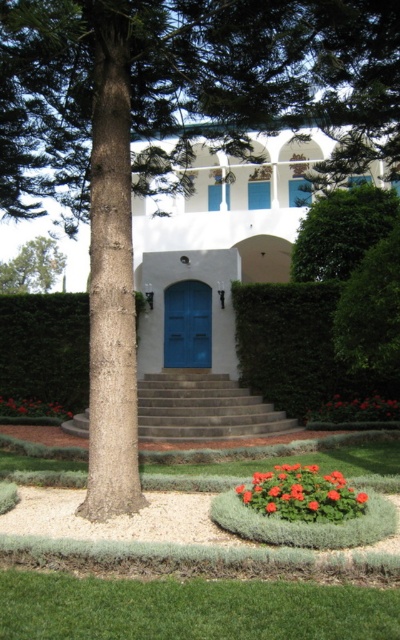
The image size is (400, 640). In order to click on green leafy hedge at center in this screenshot , I will do `click(299, 348)`.

Is green leafy hedge at center to the left of orange matte flower at center from the viewer's perspective?

Incorrect, green leafy hedge at center is not on the left side of orange matte flower at center.

Locate an element on the screen. The width and height of the screenshot is (400, 640). green leafy hedge at center is located at coordinates (299, 348).

Which is above, smooth concrete stairs at center or bright orange flowers at lower center?

Positioned higher is bright orange flowers at lower center.

Which of these two, smooth concrete stairs at center or bright orange flowers at lower center, stands shorter?

bright orange flowers at lower center is shorter.

This screenshot has width=400, height=640. Find the location of `smooth concrete stairs at center`. smooth concrete stairs at center is located at coordinates (202, 408).

I want to click on smooth concrete stairs at center, so click(202, 408).

Is green leafy hedge at center wider than vibrant red petals at center?

Correct, the width of green leafy hedge at center exceeds that of vibrant red petals at center.

Which is behind, point (275, 387) or point (287, 532)?

The point (275, 387) is behind.

This screenshot has height=640, width=400. I want to click on green leafy hedge at center, so click(299, 348).